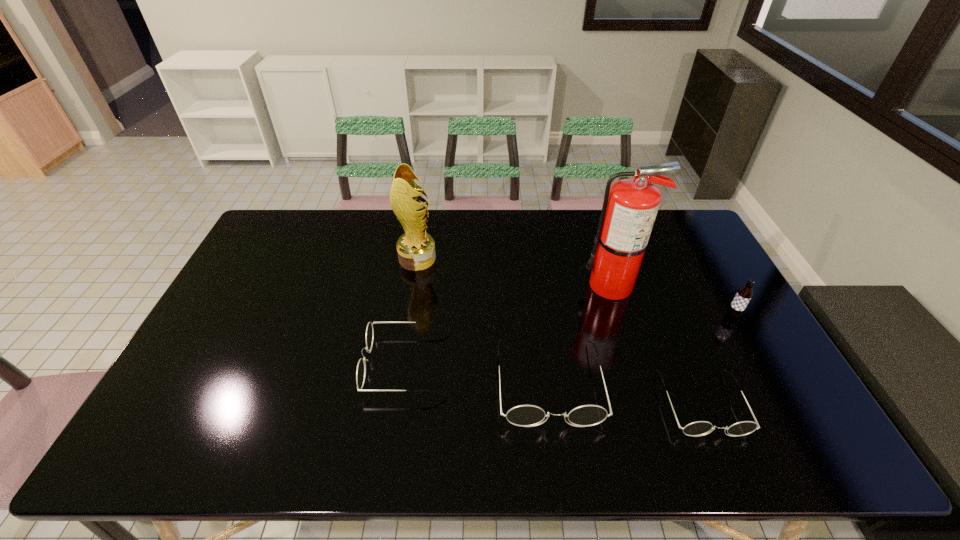
The height and width of the screenshot is (540, 960). Identify the location of object that is at the near right corner. (700, 428).

Find the location of a particular element. The image size is (960, 540). free space at the far edge of the desktop is located at coordinates (509, 244).

Where is `blank space at the near edge`? The image size is (960, 540). blank space at the near edge is located at coordinates (504, 408).

Where is `free space at the left edge of the desktop`? The width and height of the screenshot is (960, 540). free space at the left edge of the desktop is located at coordinates (261, 312).

Where is `free space at the right edge`? The image size is (960, 540). free space at the right edge is located at coordinates (698, 271).

The image size is (960, 540). I want to click on vacant area that lies between the tallest object and the leftmost spectacles, so click(x=510, y=325).

Where is `free space between the tallest object and the second tallest object`? free space between the tallest object and the second tallest object is located at coordinates (515, 272).

Where is `free space between the second tallest spectacles and the fire extinguisher`? The width and height of the screenshot is (960, 540). free space between the second tallest spectacles and the fire extinguisher is located at coordinates (510, 325).

Image resolution: width=960 pixels, height=540 pixels. I want to click on free space between the fire extinguisher and the rightmost spectacles, so click(x=657, y=345).

Identify the location of blank region between the fire extinguisher and the fifth shortest object. Image resolution: width=960 pixels, height=540 pixels. (515, 272).